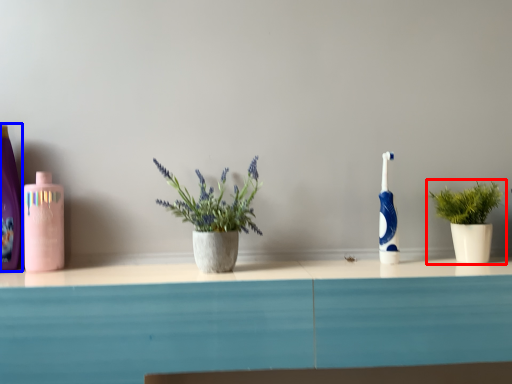
Question: Which object appears closest to the camera in this image, houseplant (highlighted by a red box) or cleaning product (highlighted by a blue box)?

Choices:
 (A) houseplant
 (B) cleaning product

Answer: (A)